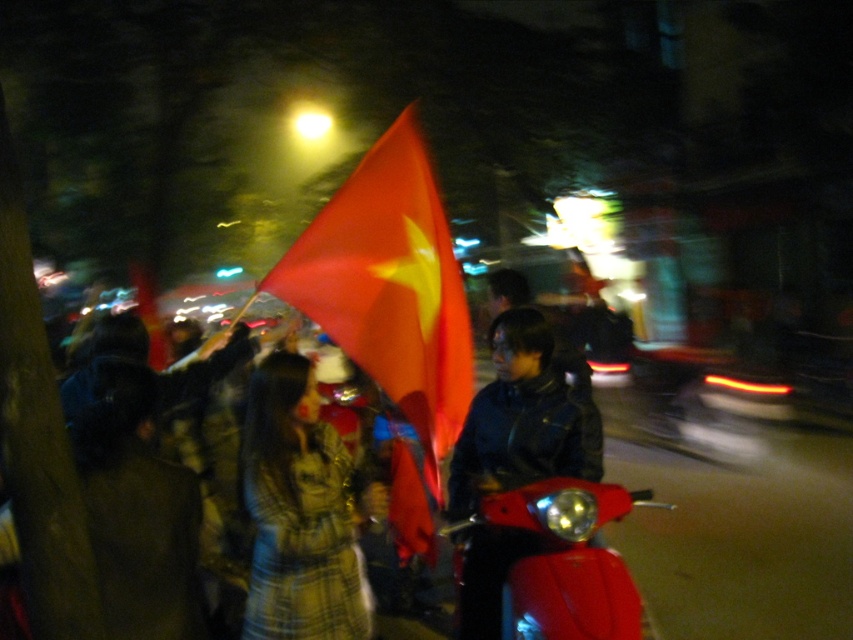
You are standing at the center of the image and want to move towards the point marked as point (299, 513). Is the plaid wool coat at center located in the direction you are facing?

The plaid wool coat at center is located at point (299, 513), so yes, it is directly in front of you at the center of the image.

You are a photographer trying to capture a clear shot of the plaid wool coat at center and the shiny red motorbike at lower right. Which object is taller in the scene?

The plaid wool coat at center is taller than the shiny red motorbike at lower right.

You are standing at the point marked by coordinates point (299, 513) in the image. What object are you directly facing?

You are directly facing the plaid wool coat at center, as the coordinates point (299, 513) marks its location.